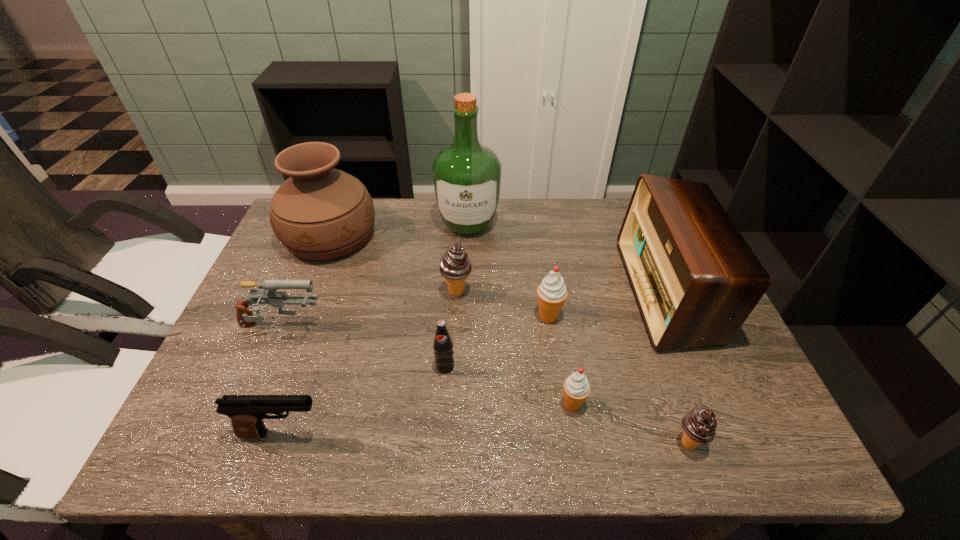
Find the location of a particular element. Image resolution: width=960 pixels, height=540 pixels. vacant region that satisfies the following two spatial constraints: 1. on the front-facing side of the radio receiver; 2. on the front label of the pop is located at coordinates (699, 367).

Where is `free spot that satisfies the following two spatial constraints: 1. at the barrel end of the gun; 2. on the right side of the nearest icecream`? Image resolution: width=960 pixels, height=540 pixels. free spot that satisfies the following two spatial constraints: 1. at the barrel end of the gun; 2. on the right side of the nearest icecream is located at coordinates (233, 443).

The height and width of the screenshot is (540, 960). Identify the location of vacant space that satisfies the following two spatial constraints: 1. on the front-facing side of the rightmost icecream; 2. on the left side of the liquor. (461, 443).